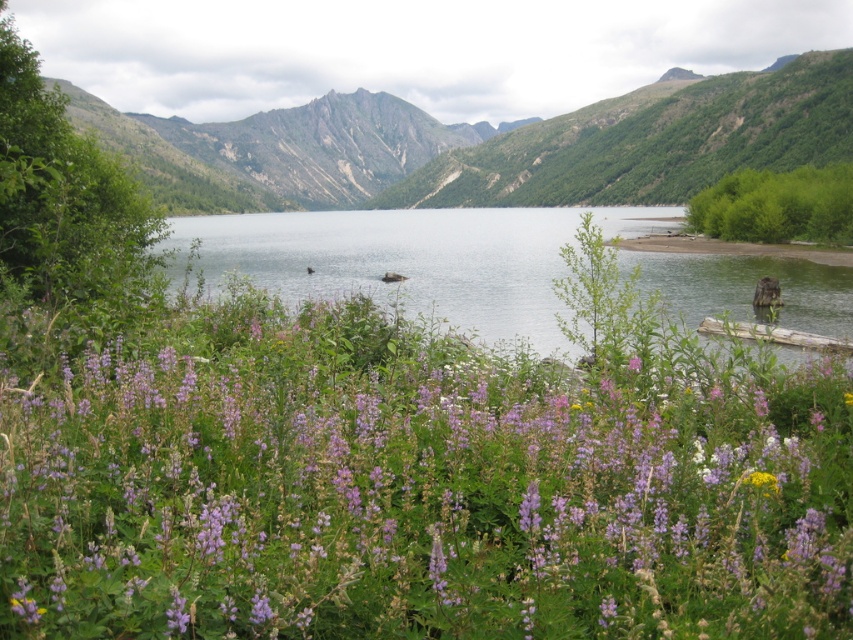
Between purple soft-textured flowers at center and clear water at center, which one has more height?

Standing taller between the two is clear water at center.

At what (x,y) coordinates should I click in order to perform the action: click on purple soft-textured flowers at center. Please return your answer as a coordinate pair (x, y). The image size is (853, 640). Looking at the image, I should click on (421, 486).

Is green rock mountain at center in front of clear water at center?

That is False.

Is green rock mountain at center smaller than clear water at center?

No.

Between point (483, 147) and point (236, 237), which one is positioned in front?

Point (236, 237)

You are a GUI agent. You are given a task and a screenshot of the screen. Output one action in this format:
    pyautogui.click(x=<x>, y=<y>)
    Task: Click on the green rock mountain at center
    The width and height of the screenshot is (853, 640).
    Given the screenshot: What is the action you would take?
    pyautogui.click(x=526, y=147)

Is point (265, 400) positioned before point (265, 129)?

Yes, it is.

Does purple soft-textured flowers at center appear on the right side of green rock mountain at center?

Yes, purple soft-textured flowers at center is to the right of green rock mountain at center.

Between point (677, 372) and point (653, 177), which one is positioned in front?

Point (677, 372) is in front.

The height and width of the screenshot is (640, 853). I want to click on purple soft-textured flowers at center, so [x=421, y=486].